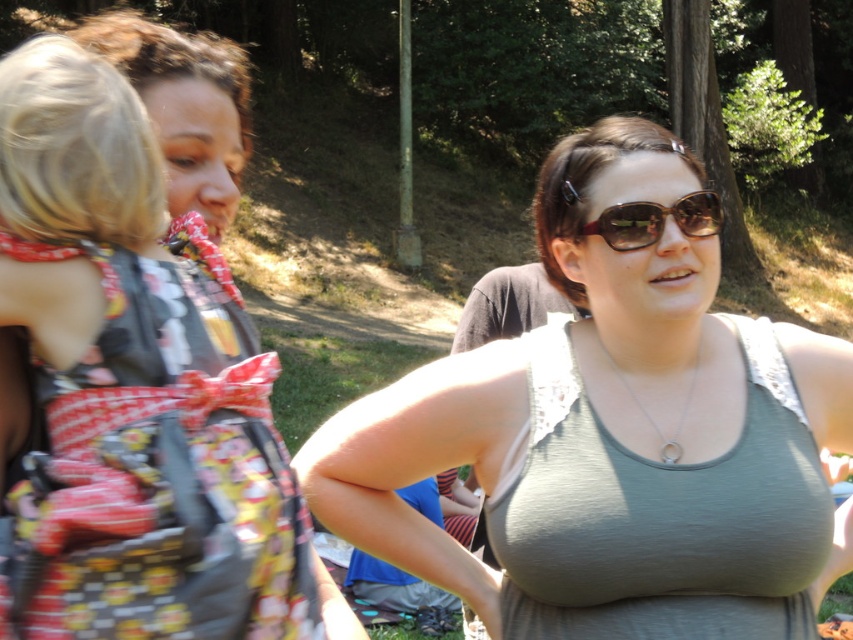
Question: Does matte black dress at upper left have a smaller size compared to gray fabric vest at center?

Choices:
 (A) yes
 (B) no

Answer: (B)

Question: Which point appears closest to the camera in this image?

Choices:
 (A) (691, 385)
 (B) (624, 221)

Answer: (B)

Question: Estimate the real-world distances between objects in this image. Which object is farther from the silver metallic necklace at center?

Choices:
 (A) gray fabric vest at center
 (B) matte gray tank top at center

Answer: (A)

Question: Is the position of matte gray tank top at center more distant than that of matte black dress at upper left?

Choices:
 (A) yes
 (B) no

Answer: (A)

Question: Can you confirm if matte black dress at upper left is thinner than sunglasses at center?

Choices:
 (A) no
 (B) yes

Answer: (A)

Question: Which of the following is the closest to the observer?

Choices:
 (A) silver metallic necklace at center
 (B) sunglasses at center

Answer: (B)